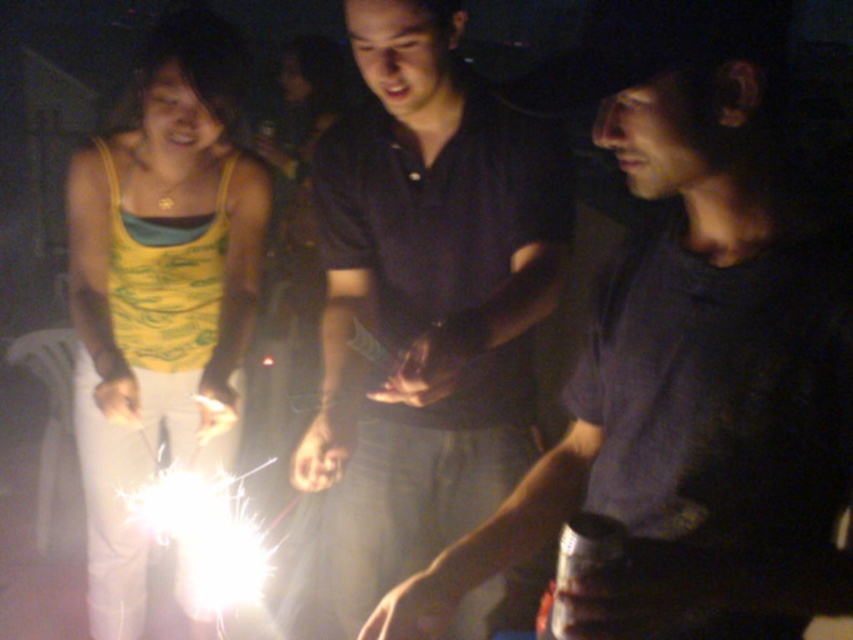
Question: Which point is farther to the camera?

Choices:
 (A) (772, 307)
 (B) (144, 316)
 (C) (451, 360)

Answer: (B)

Question: Which point is closer to the camera taking this photo?

Choices:
 (A) (456, 260)
 (B) (190, 205)

Answer: (A)

Question: Is matte black shirt at center in front of yellow printed tank top at left?

Choices:
 (A) yes
 (B) no

Answer: (A)

Question: Can you confirm if matte black shirt at center is positioned to the right of dark purple shirt at center?

Choices:
 (A) no
 (B) yes

Answer: (B)

Question: Which object appears farthest from the camera in this image?

Choices:
 (A) dark purple shirt at center
 (B) yellow printed tank top at left
 (C) matte black shirt at center

Answer: (B)

Question: Does matte black shirt at center have a smaller size compared to dark purple shirt at center?

Choices:
 (A) yes
 (B) no

Answer: (A)